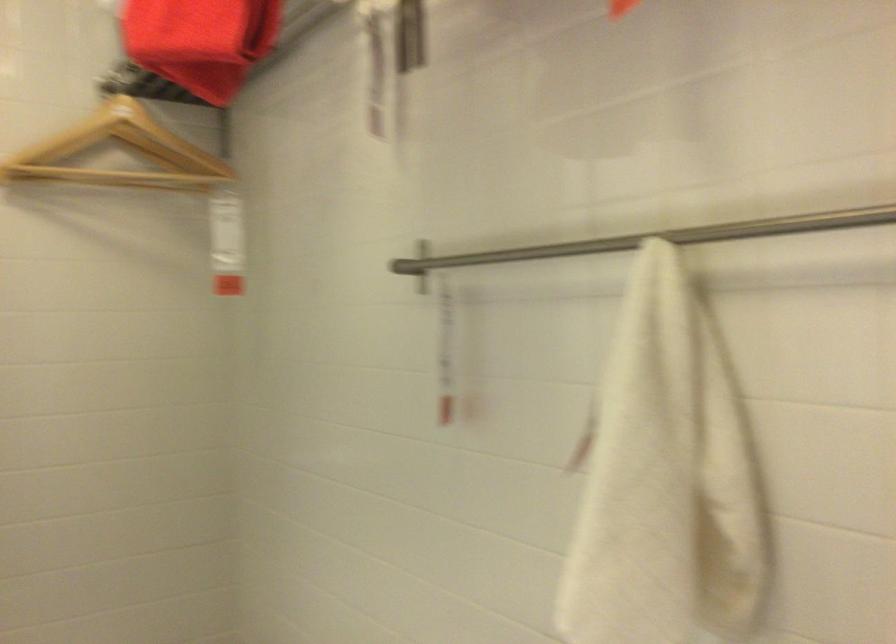
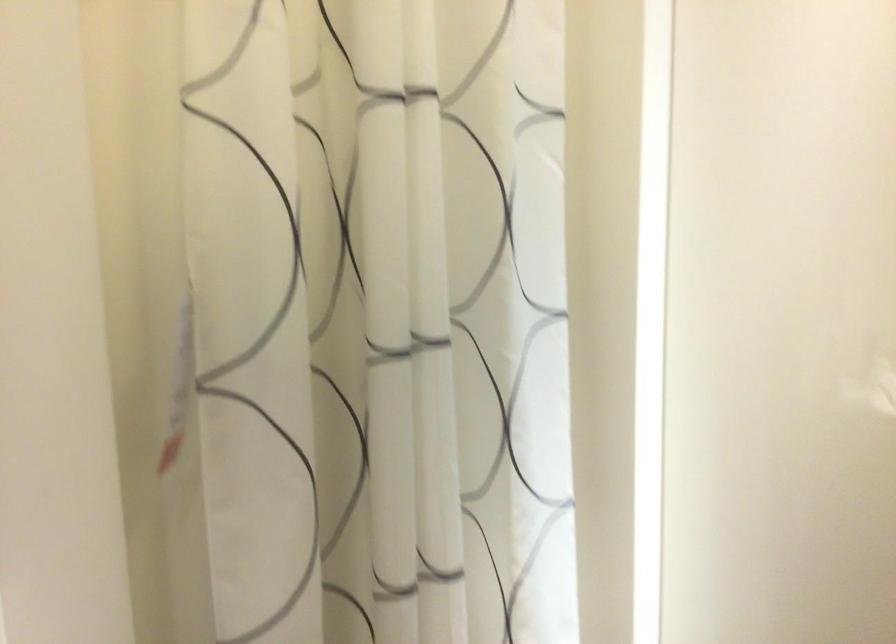
Question: The camera is either moving clockwise (left) or counter-clockwise (right) around the object. The first image is from the beginning of the video and the second image is from the end. Is the camera moving left or right when shooting the video?

Choices:
 (A) Left
 (B) Right

Answer: (B)